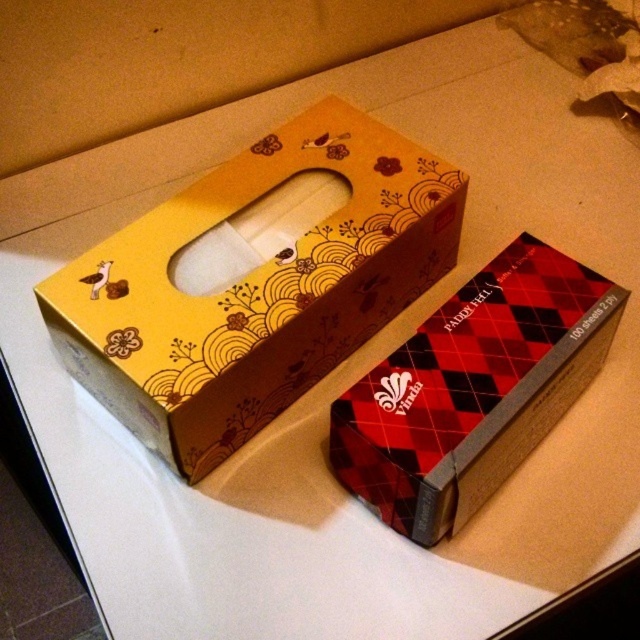
Question: Can you confirm if matte brown tissue box at upper left is wider than red argyle-patterned tissue box at center-right?

Choices:
 (A) no
 (B) yes

Answer: (B)

Question: Is matte brown tissue box at upper left bigger than red argyle-patterned tissue box at center-right?

Choices:
 (A) no
 (B) yes

Answer: (B)

Question: Among these objects, which one is nearest to the camera?

Choices:
 (A) matte brown tissue box at upper left
 (B) red argyle-patterned tissue box at center-right

Answer: (B)

Question: Which of the following is the farthest from the observer?

Choices:
 (A) matte brown tissue box at upper left
 (B) red argyle-patterned tissue box at center-right

Answer: (A)

Question: Is matte brown tissue box at upper left below red argyle-patterned tissue box at center-right?

Choices:
 (A) yes
 (B) no

Answer: (B)